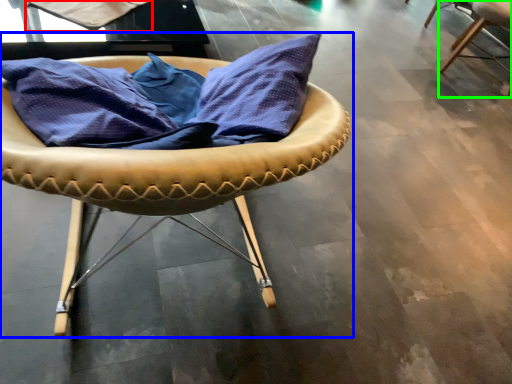
Question: Which object is the farthest from fabric (highlighted by a red box)? Choose among these: chair (highlighted by a blue box) or chair (highlighted by a green box).

Choices:
 (A) chair
 (B) chair

Answer: (B)